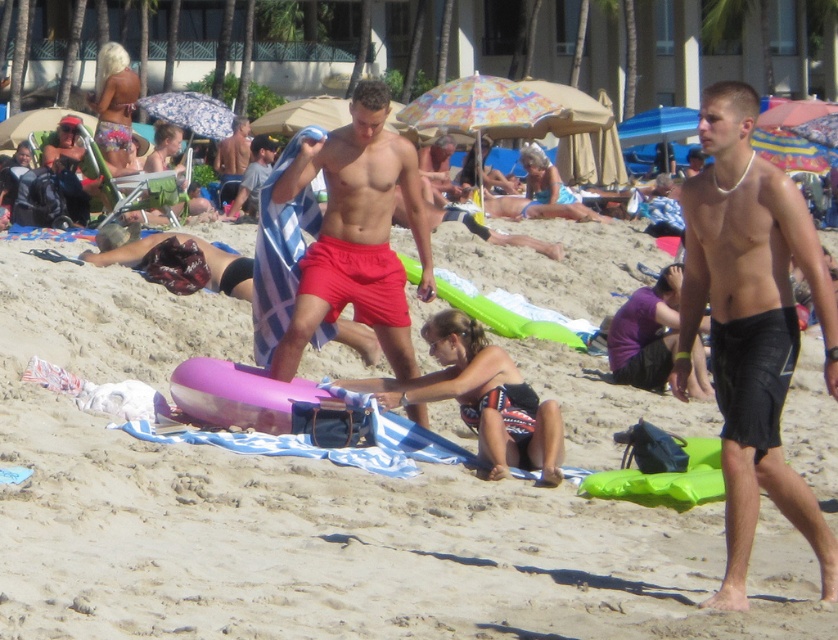
Question: Does black matte shorts at right have a smaller size compared to shiny blue towel at center?

Choices:
 (A) yes
 (B) no

Answer: (A)

Question: Is black matte shorts at right smaller than shiny blue towel at center?

Choices:
 (A) no
 (B) yes

Answer: (B)

Question: Which point is farther to the camera?

Choices:
 (A) (59, 273)
 (B) (728, 141)
 (C) (358, 204)
 (D) (241, 168)

Answer: (D)

Question: From the image, what is the correct spatial relationship of pink foam float at center in relation to black matte shorts at right?

Choices:
 (A) left
 (B) right

Answer: (A)

Question: Which point appears closest to the camera in this image?

Choices:
 (A) (215, 157)
 (B) (746, 154)
 (C) (508, 593)

Answer: (B)

Question: Which object is farther from the camera taking this photo?

Choices:
 (A) black matte shorts at right
 (B) pink foam float at center
 (C) red matte shorts at center
 (D) shiny blue towel at center

Answer: (D)